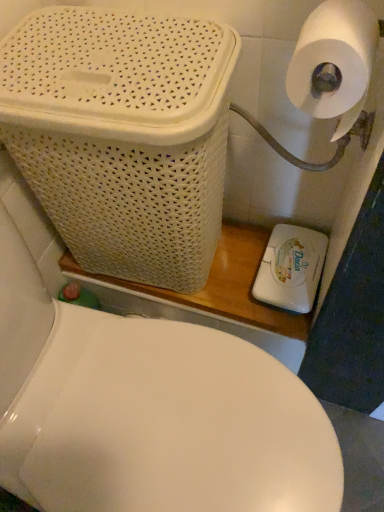
Question: Would you say white plastic soap dispenser at lower right is inside or outside white matte toilet paper at upper right?

Choices:
 (A) outside
 (B) inside

Answer: (A)

Question: From the image's perspective, relative to white matte toilet paper at upper right, is white plastic soap dispenser at lower right above or below?

Choices:
 (A) above
 (B) below

Answer: (B)

Question: Which object is the closest to the white glossy toilet at center?

Choices:
 (A) white plastic soap dispenser at lower right
 (B) white matte toilet paper at upper right
 (C) white wicker basket at upper left

Answer: (C)

Question: Considering the real-world distances, which object is closest to the white matte toilet paper at upper right?

Choices:
 (A) white glossy toilet at center
 (B) white plastic soap dispenser at lower right
 (C) white wicker basket at upper left

Answer: (C)